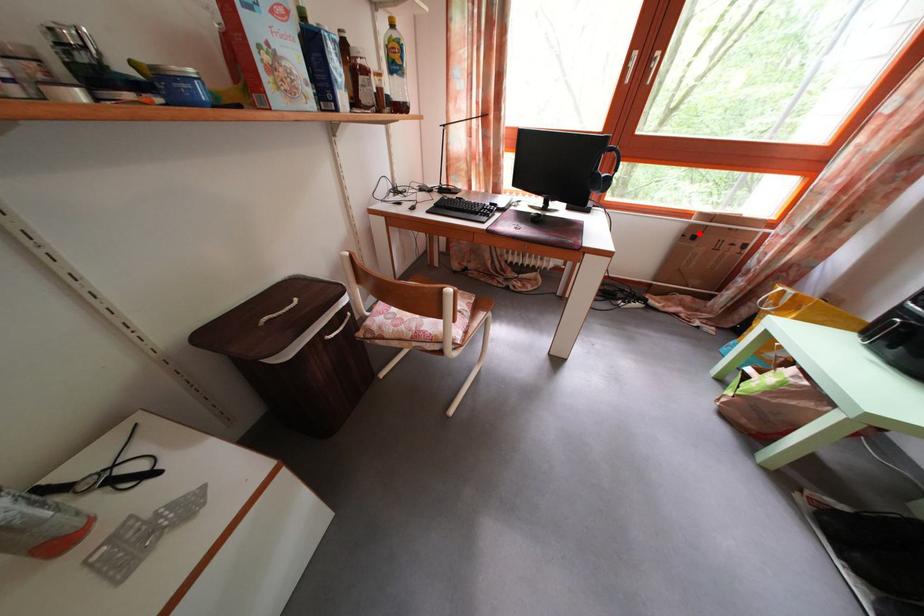
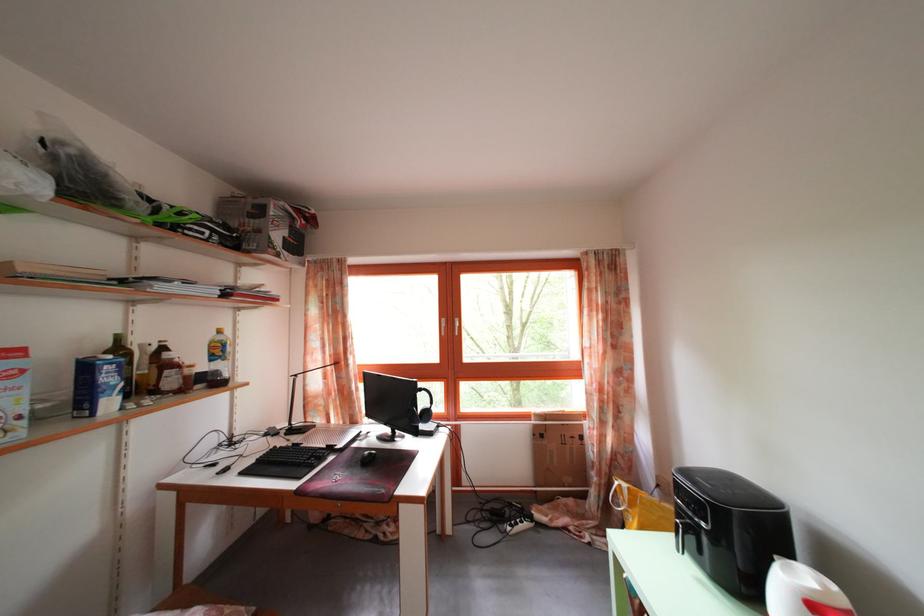
Find the pixel in the second image that matches the highlighted location in the first image.

(542, 432)